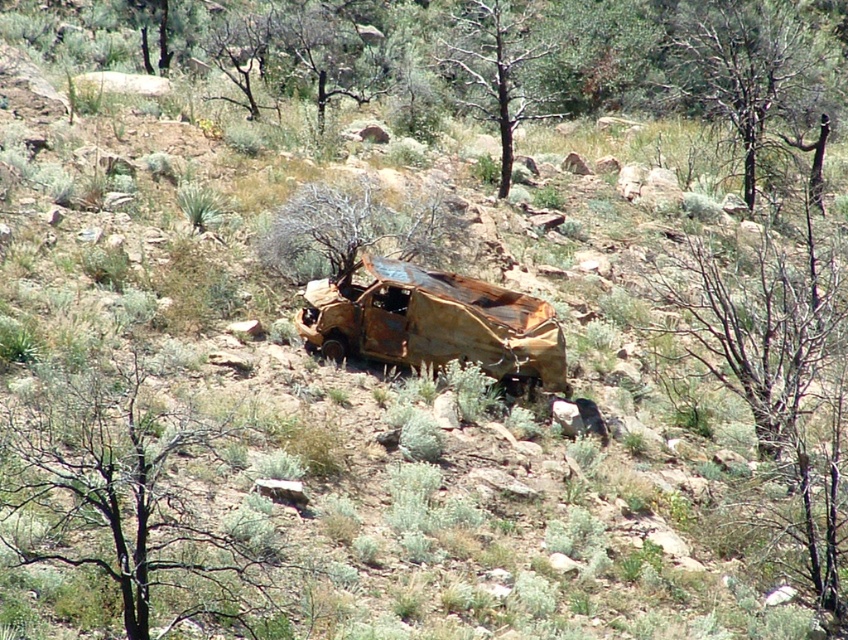
You are a hiker trying to navigate through the desert. You see a brown bark tree at upper right and a brown dry wood at center. Which object is closer to you?

The brown bark tree at upper right is closer to you because it is further to the viewer than the brown dry wood at center.

Consider the image. You are navigating through the desert and come across the charred wood tree at center. Can you determine its exact coordinates based on the image?

The charred wood tree at center is located at point (127, 499).

You are a hiker in the desert and you see the brown bark tree at upper right and the brown dry wood at center. Which one is taller?

The brown bark tree at upper right is taller than the brown dry wood at center.